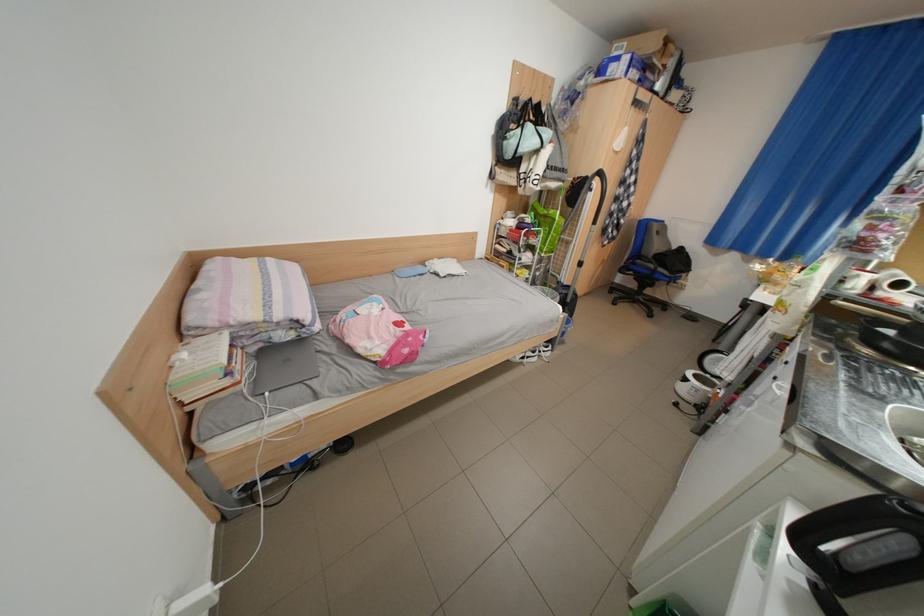
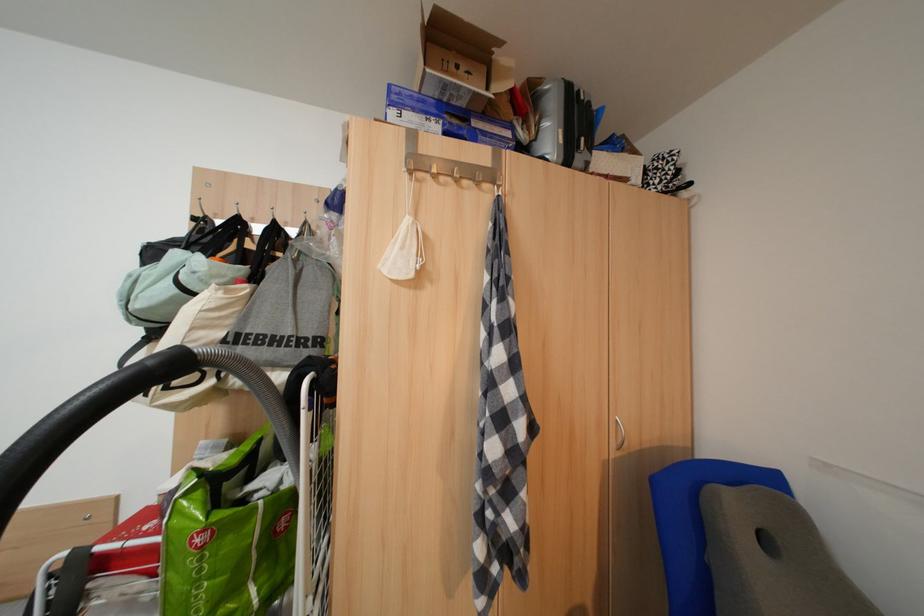
Find the pixel in the second image that matches (x=671, y=75) in the first image.

(541, 130)